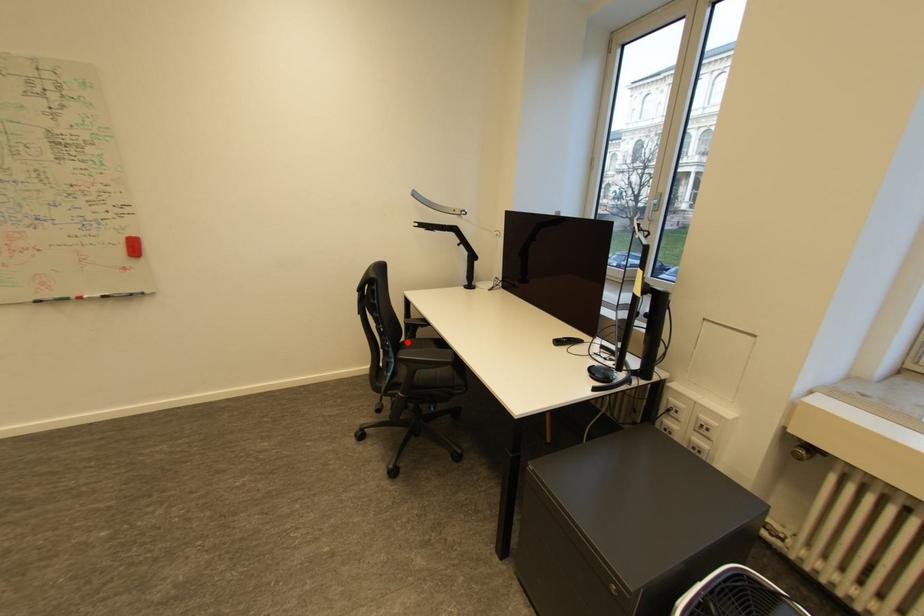
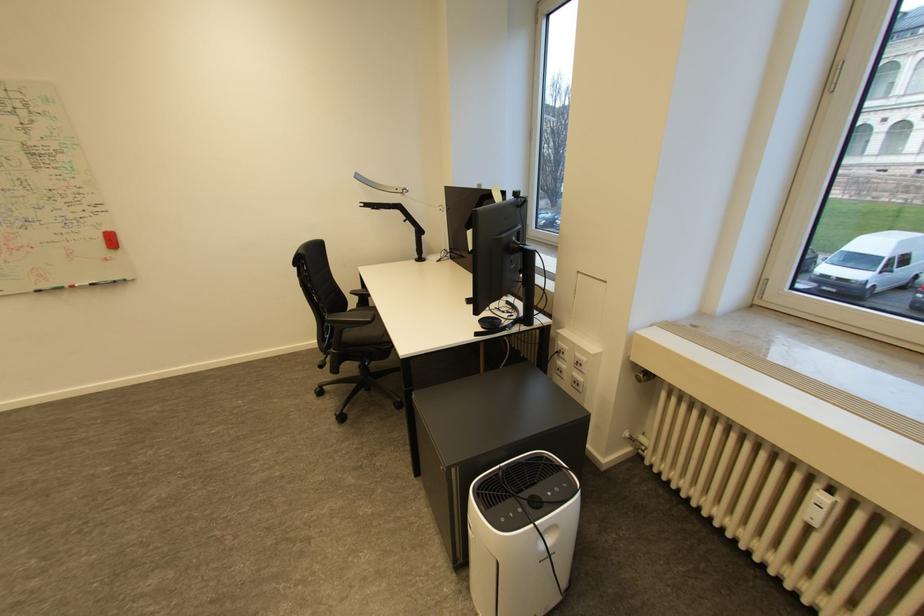
In the second image, find the point that corresponds to the highlighted location in the first image.

(355, 310)